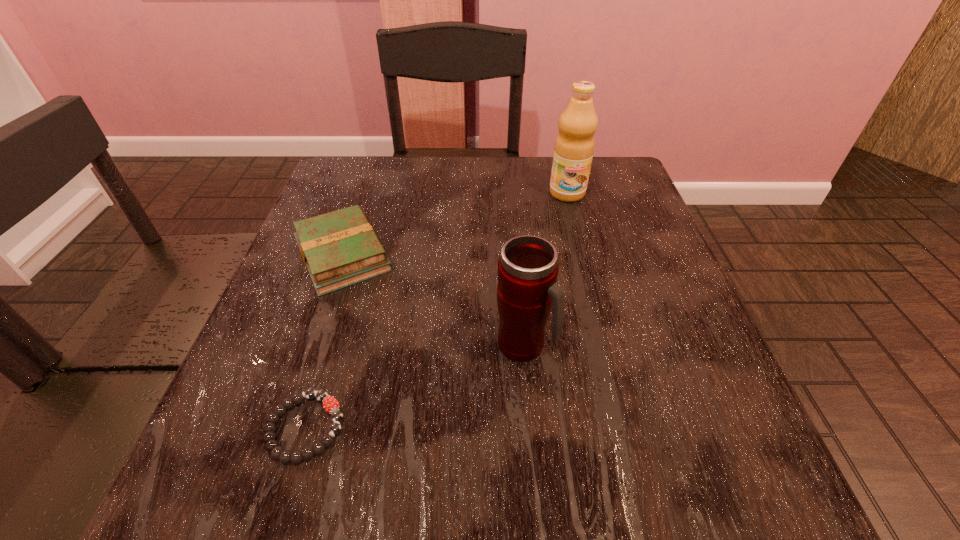
Locate an element on the screen. vacant space that is in between the third nearest object and the bracelet is located at coordinates (324, 341).

The image size is (960, 540). Identify the location of vacant point located between the book and the shortest object. (324, 341).

This screenshot has height=540, width=960. Find the location of `free space between the third shortest object and the third nearest object`. free space between the third shortest object and the third nearest object is located at coordinates (434, 300).

Where is `object identified as the second closest to the shortest object`? object identified as the second closest to the shortest object is located at coordinates (527, 271).

Point out which object is positioned as the third nearest to the farthest object. Please provide its 2D coordinates. Your answer should be formatted as a tuple, i.e. [(x, y)], where the tuple contains the x and y coordinates of a point satisfying the conditions above.

[(330, 404)]

Find the location of a particular element. The image size is (960, 540). blank space that satisfies the following two spatial constraints: 1. on the label of the tallest object; 2. on the side with the handle of the thermos bottle is located at coordinates (606, 345).

In order to click on vacant area in the image that satisfies the following two spatial constraints: 1. on the front side of the shortest object; 2. on the left side of the second shortest object in this screenshot , I will do `click(285, 427)`.

You are a GUI agent. You are given a task and a screenshot of the screen. Output one action in this format:
    pyautogui.click(x=<x>, y=<y>)
    Task: Click on the vacant space that satisfies the following two spatial constraints: 1. on the front side of the third nearest object; 2. on the right side of the bracelet
    The width and height of the screenshot is (960, 540).
    Given the screenshot: What is the action you would take?
    pyautogui.click(x=285, y=427)

Identify the location of free spot that satisfies the following two spatial constraints: 1. on the side with the handle of the third shortest object; 2. on the front side of the shortest object. The width and height of the screenshot is (960, 540). (531, 427).

Identify the location of free spot that satisfies the following two spatial constraints: 1. on the label of the tallest object; 2. on the side with the handle of the thermos bottle. This screenshot has width=960, height=540. (606, 345).